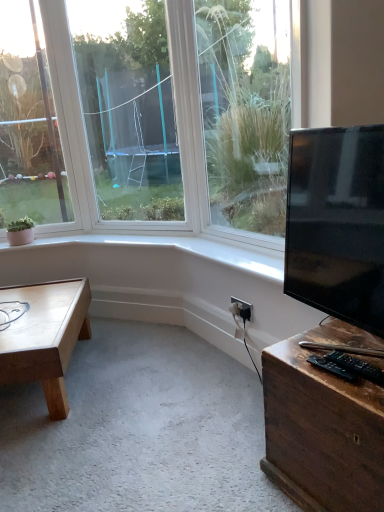
You are a GUI agent. You are given a task and a screenshot of the screen. Output one action in this format:
    pyautogui.click(x=<x>, y=<y>)
    Task: Click on the black plastic remote control at lower right, the 2th wide viewed from the right
    
    Given the screenshot: What is the action you would take?
    pyautogui.click(x=332, y=368)

This screenshot has width=384, height=512. Describe the element at coordinates (357, 366) in the screenshot. I see `black plastic remote control at lower right, positioned as the 2th wide in left-to-right order` at that location.

Based on the photo, how much space does black plastic remote control at lower right, placed as the first wide when sorted from right to left, occupy vertically?

The height of black plastic remote control at lower right, placed as the first wide when sorted from right to left, is 2.56 centimeters.

The image size is (384, 512). Describe the element at coordinates (44, 336) in the screenshot. I see `light brown wooden coffee table at lower left` at that location.

Image resolution: width=384 pixels, height=512 pixels. What do you see at coordinates (29, 123) in the screenshot?
I see `clear glass window at upper left` at bounding box center [29, 123].

Locate an element on the screen. wooden desk at lower right is located at coordinates (323, 426).

Considering the points (380, 372) and (237, 303), which point is behind, point (380, 372) or point (237, 303)?

Positioned behind is point (237, 303).

Does black plastic remote control at lower right, placed as the first wide when sorted from right to left, touch black plastic electric outlet at lower right?

No.

Considering the positions of objects black plastic remote control at lower right, placed as the first wide when sorted from right to left, and black plastic electric outlet at lower right in the image provided, who is more to the right, black plastic remote control at lower right, placed as the first wide when sorted from right to left, or black plastic electric outlet at lower right?

From the viewer's perspective, black plastic remote control at lower right, placed as the first wide when sorted from right to left, appears more on the right side.

Can you confirm if light brown wooden coffee table at lower left is shorter than clear glass window at upper left?

Correct, light brown wooden coffee table at lower left is not as tall as clear glass window at upper left.

Can you tell me how much light brown wooden coffee table at lower left and clear glass window at upper left differ in facing direction?

They differ by 0.000661 degrees in their facing directions.

Could you tell me if light brown wooden coffee table at lower left is turned towards clear glass window at upper left?

No, light brown wooden coffee table at lower left does not turn towards clear glass window at upper left.

Are black glossy tv at right and clear glass window at upper left making contact?

No, black glossy tv at right is not in contact with clear glass window at upper left.

Considering the relative sizes of black glossy tv at right and clear glass window at upper left in the image provided, is black glossy tv at right taller than clear glass window at upper left?

Incorrect, the height of black glossy tv at right is not larger of that of clear glass window at upper left.

Could you tell me if black glossy tv at right is turned towards clear glass window at upper left?

No.

How much distance is there between black glossy tv at right and clear glass window at upper left?

The distance of black glossy tv at right from clear glass window at upper left is 1.86 meters.

From a real-world perspective, is light brown wooden coffee table at lower left on top of black glossy tv at right?

Incorrect, from a real-world perspective, light brown wooden coffee table at lower left is lower than black glossy tv at right.

Based on the photo, considering the relative sizes of light brown wooden coffee table at lower left and black glossy tv at right in the image provided, is light brown wooden coffee table at lower left smaller than black glossy tv at right?

Incorrect, light brown wooden coffee table at lower left is not smaller in size than black glossy tv at right.

Are light brown wooden coffee table at lower left and black glossy tv at right far apart?

Yes, light brown wooden coffee table at lower left is far from black glossy tv at right.

Can you confirm if light brown wooden coffee table at lower left is taller than black glossy tv at right?

No.

Is wooden desk at lower right far from black plastic electric outlet at lower right?

No, wooden desk at lower right is not far from black plastic electric outlet at lower right.

Could you tell me if wooden desk at lower right is turned towards black plastic electric outlet at lower right?

No, wooden desk at lower right is not oriented towards black plastic electric outlet at lower right.

Is wooden desk at lower right spatially inside black plastic electric outlet at lower right, or outside of it?

wooden desk at lower right is not inside black plastic electric outlet at lower right, it's outside.

Looking at this image, from the image's perspective, between light brown wooden coffee table at lower left and wooden desk at lower right, which one is located above?

From the image's view, light brown wooden coffee table at lower left is above.

Which is more distant, (27, 343) or (273, 445)?

The point (27, 343) is farther.

Is light brown wooden coffee table at lower left bigger or smaller than wooden desk at lower right?

light brown wooden coffee table at lower left is bigger than wooden desk at lower right.

Can you tell me how much black glossy tv at right and black plastic electric outlet at lower right differ in facing direction?

4.6 degrees.

Does point (361, 173) come in front of point (238, 315)?

That is True.

Is black glossy tv at right beside black plastic electric outlet at lower right?

black glossy tv at right and black plastic electric outlet at lower right are clearly separated.

Considering the positions of objects black glossy tv at right and black plastic electric outlet at lower right in the image provided, who is more to the left, black glossy tv at right or black plastic electric outlet at lower right?

Positioned to the left is black plastic electric outlet at lower right.

At what (x,y) coordinates should I click in order to perform the action: click on the 1st wide below the black plastic electric outlet at lower right (from the image's perspective). Please return your answer as a coordinate pair (x, y). The width and height of the screenshot is (384, 512). Looking at the image, I should click on (357, 366).

The image size is (384, 512). Find the location of `window behind the light brown wooden coffee table at lower left`. window behind the light brown wooden coffee table at lower left is located at coordinates (29, 123).

Considering their positions, is black plastic electric outlet at lower right positioned closer to black glossy tv at right than black plastic remote control at lower right, the 2th wide viewed from the right?

black plastic remote control at lower right, the 2th wide viewed from the right, is closer to black glossy tv at right.

Which object lies further to the anchor point black plastic remote control at lower right, positioned as the 2th wide in left-to-right order, wooden desk at lower right or light brown wooden coffee table at lower left?

Based on the image, light brown wooden coffee table at lower left appears to be further to black plastic remote control at lower right, positioned as the 2th wide in left-to-right order.

From the image, which object appears to be nearer to black glossy tv at right, clear glass window at upper left or black plastic remote control at lower right, which is counted as the first wide, starting from the left?

black plastic remote control at lower right, which is counted as the first wide, starting from the left.

Estimate the real-world distances between objects in this image. Which object is further from clear glass window at upper left, black plastic remote control at lower right, the 2th wide viewed from the right, or black plastic electric outlet at lower right?

Based on the image, black plastic remote control at lower right, the 2th wide viewed from the right, appears to be further to clear glass window at upper left.

Which object lies further to the anchor point light brown wooden coffee table at lower left, black plastic remote control at lower right, positioned as the 2th wide in left-to-right order, or wooden desk at lower right?

The object further to light brown wooden coffee table at lower left is black plastic remote control at lower right, positioned as the 2th wide in left-to-right order.

When comparing their distances from clear glass window at upper left, does black plastic electric outlet at lower right or black plastic remote control at lower right, placed as the first wide when sorted from right to left, seem further?

Based on the image, black plastic remote control at lower right, placed as the first wide when sorted from right to left, appears to be further to clear glass window at upper left.

When comparing their distances from black plastic remote control at lower right, placed as the first wide when sorted from right to left, does light brown wooden coffee table at lower left or black glossy tv at right seem further?

Based on the image, light brown wooden coffee table at lower left appears to be further to black plastic remote control at lower right, placed as the first wide when sorted from right to left.

Based on their spatial positions, is black plastic remote control at lower right, which is counted as the first wide, starting from the left, or black glossy tv at right closer to light brown wooden coffee table at lower left?

Among the two, black glossy tv at right is located nearer to light brown wooden coffee table at lower left.

Locate an element on the screen. This screenshot has height=512, width=384. television situated between light brown wooden coffee table at lower left and black plastic remote control at lower right, positioned as the 2th wide in left-to-right order, from left to right is located at coordinates (337, 223).

This screenshot has width=384, height=512. What are the coordinates of `television situated between clear glass window at upper left and black plastic remote control at lower right, placed as the first wide when sorted from right to left, from left to right` in the screenshot? It's located at (337, 223).

This screenshot has height=512, width=384. I want to click on electric outlet between clear glass window at upper left and black plastic remote control at lower right, the 2th wide viewed from the right, so click(x=243, y=309).

Locate an element on the screen. The height and width of the screenshot is (512, 384). electric outlet situated between clear glass window at upper left and wooden desk at lower right from left to right is located at coordinates (243, 309).